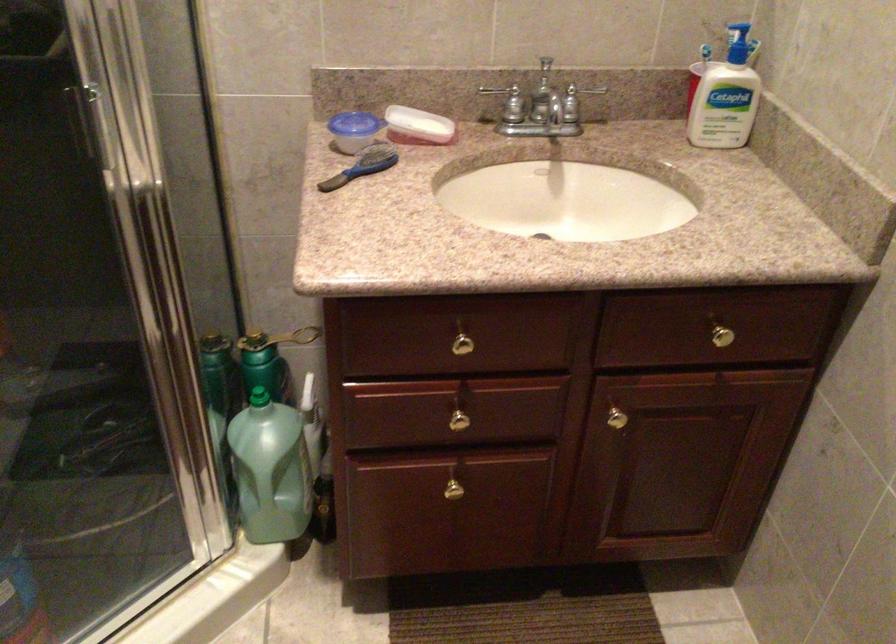
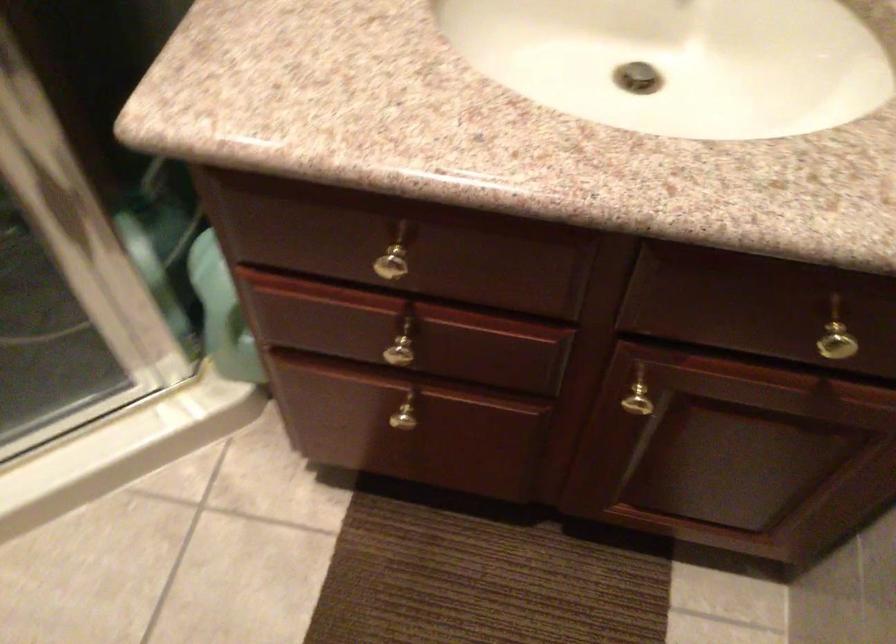
Question: The images are taken continuously from a first-person perspective. In which direction is your viewpoint rotating?

Choices:
 (A) Left
 (B) Right
 (C) Up
 (D) Down

Answer: (D)